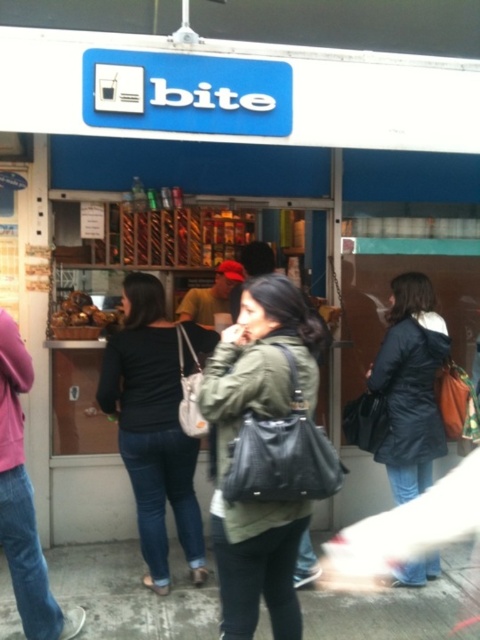
Question: Does dark blue coat at center come behind denim jeans at left?

Choices:
 (A) yes
 (B) no

Answer: (A)

Question: Can you confirm if black leather jacket at center is thinner than denim jeans at left?

Choices:
 (A) no
 (B) yes

Answer: (A)

Question: Among these objects, which one is farthest from the camera?

Choices:
 (A) black leather jacket at center
 (B) denim jeans at left
 (C) matte black bag at center
 (D) dark blue coat at center

Answer: (D)

Question: Which object appears closest to the camera in this image?

Choices:
 (A) matte black bag at center
 (B) denim jeans at left

Answer: (A)

Question: Which of these objects is positioned farthest from the matte black bag at center?

Choices:
 (A) black leather jacket at center
 (B) denim jeans at left
 (C) dark blue coat at center

Answer: (C)

Question: Is black leather jacket at center to the left of dark blue coat at center from the viewer's perspective?

Choices:
 (A) no
 (B) yes

Answer: (B)